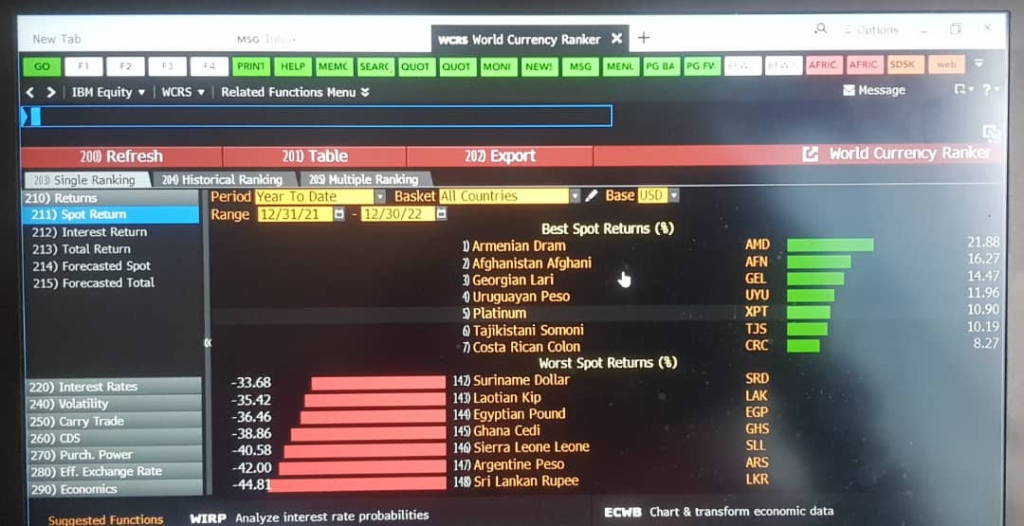
At what (x,y) coordinates should I click in order to perform the action: click on screen. Please return your answer as a coordinate pair (x, y). Looking at the image, I should click on (746, 247).